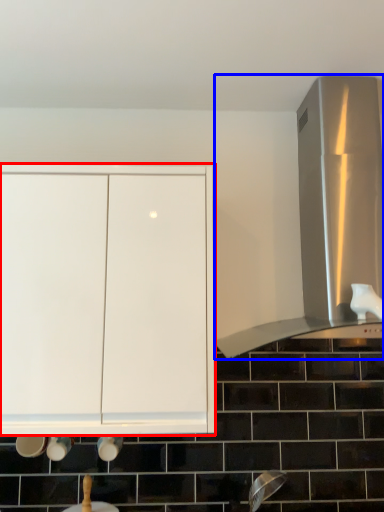
Question: Which object appears farthest to the camera in this image, cabinetry (highlighted by a red box) or vent (highlighted by a blue box)?

Choices:
 (A) cabinetry
 (B) vent

Answer: (B)